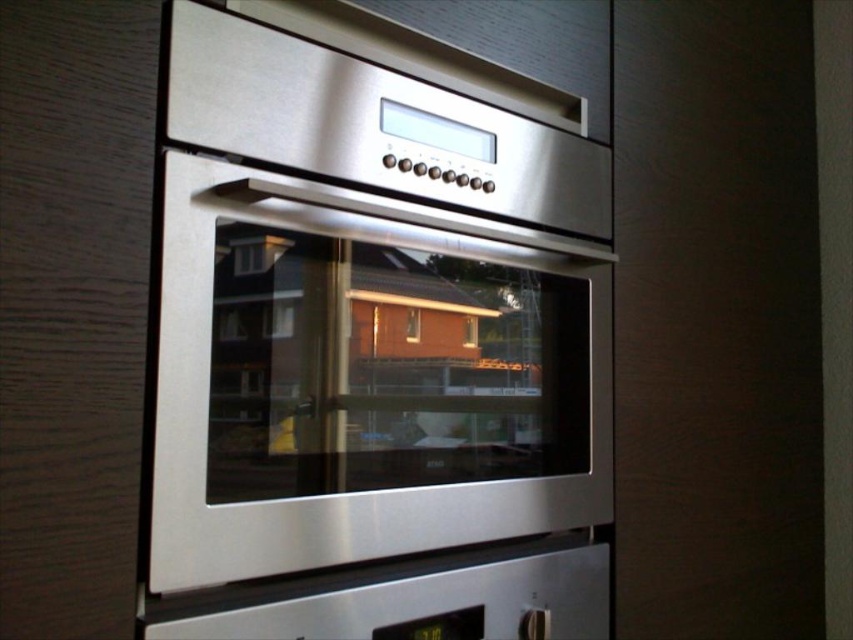
Does stainless steel oven at center lie behind satin metallic exhaust hood at upper center?

No.

Does stainless steel oven at center appear on the right side of satin metallic exhaust hood at upper center?

Yes, stainless steel oven at center is to the right of satin metallic exhaust hood at upper center.

Who is more forward, (309, 540) or (494, 90)?

Positioned in front is point (309, 540).

Locate an element on the screen. stainless steel oven at center is located at coordinates (372, 355).